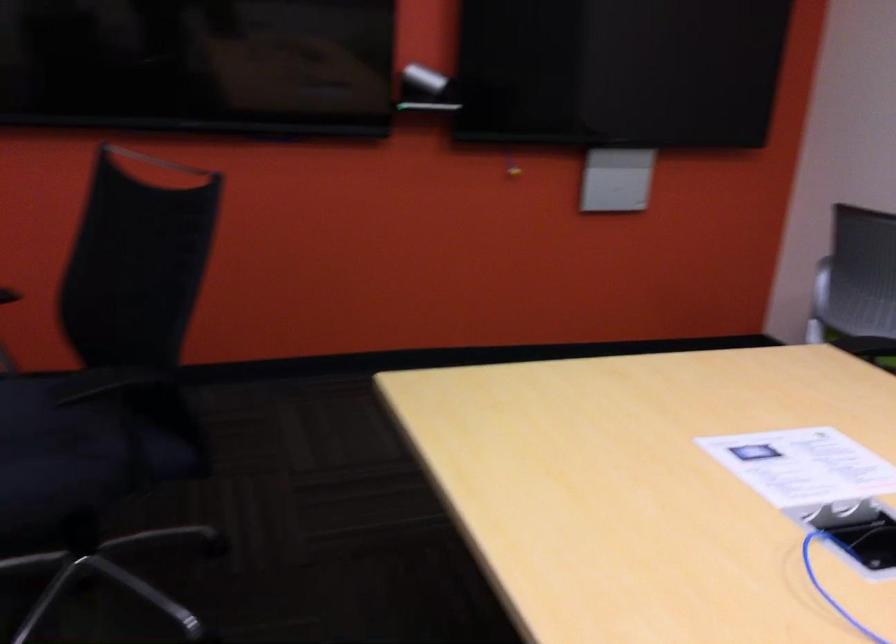
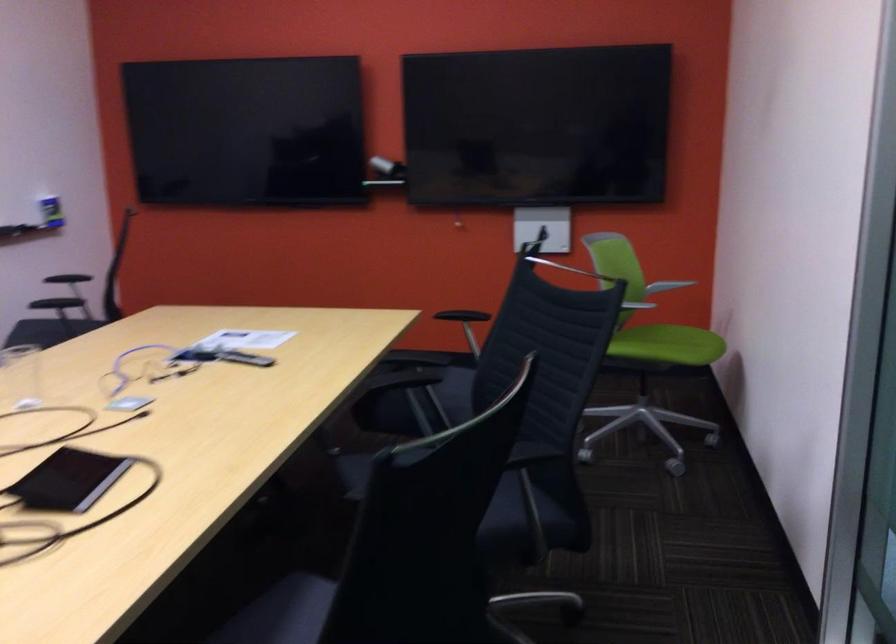
The images are taken continuously from a first-person perspective. In which direction are you moving?

The movement direction of the cameraman is right, backward.